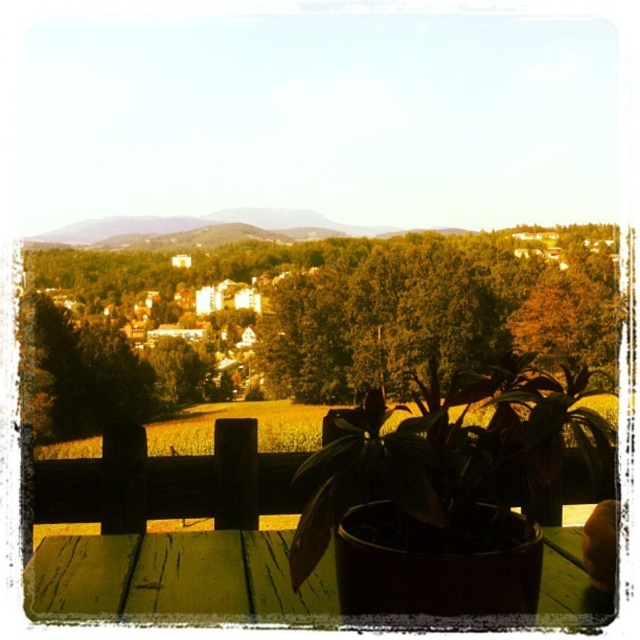
You are standing on the balcony and want to place a new potted plant that is 3 feet wide between the green matte plant at center and the green wood picnic table at center. Can the space between them accommodate the new plant?

The distance between the green matte plant at center and the green wood picnic table at center is 23.69 feet. Since the new plant is only 3 feet wide, there is sufficient space to place it between them.

You are a gardener who wants to replace the green matte plant at center with a smaller one. Which object on the green wood picnic table at center would you need to move first?

The green matte plant at center is larger in size than the green wood picnic table at center, so you would need to move the plant first to replace it with a smaller one.

You are standing on a balcony and want to place a small decorative item on the closest object between the green matte plant at center and the green wood picnic table at center. Which object should you choose?

The green matte plant at center is closer to the viewer than the green wood picnic table at center, so you should place the decorative item on the green matte plant at center.